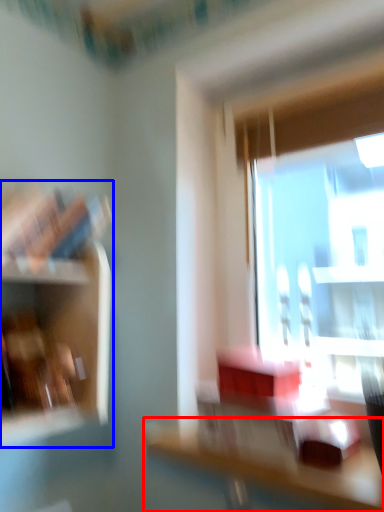
Question: Which of the following is the farthest to the observer, table (highlighted by a red box) or shelf (highlighted by a blue box)?

Choices:
 (A) table
 (B) shelf

Answer: (B)